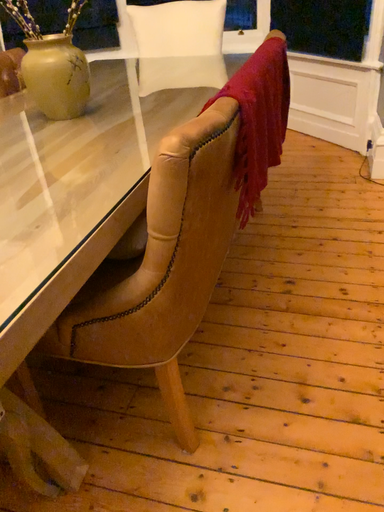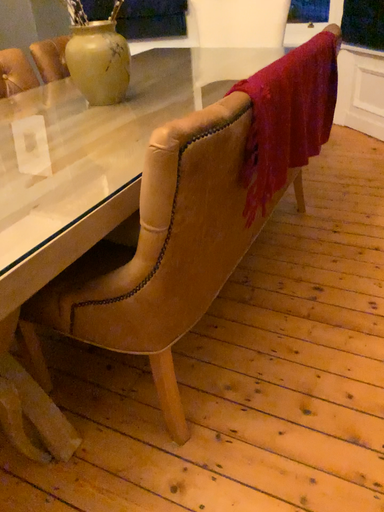
Question: Which way did the camera rotate in the video?

Choices:
 (A) rotated left
 (B) rotated right

Answer: (A)